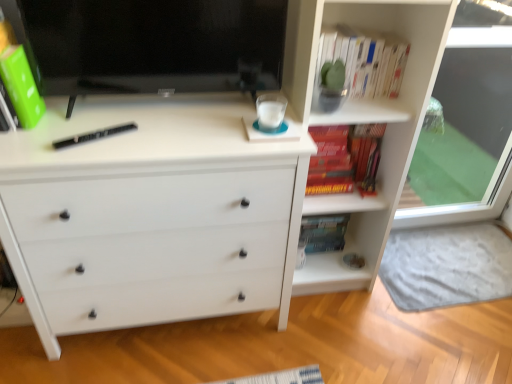
The width and height of the screenshot is (512, 384). Find the location of `spots to the right of white matte chest of drawers at center`. spots to the right of white matte chest of drawers at center is located at coordinates (327, 339).